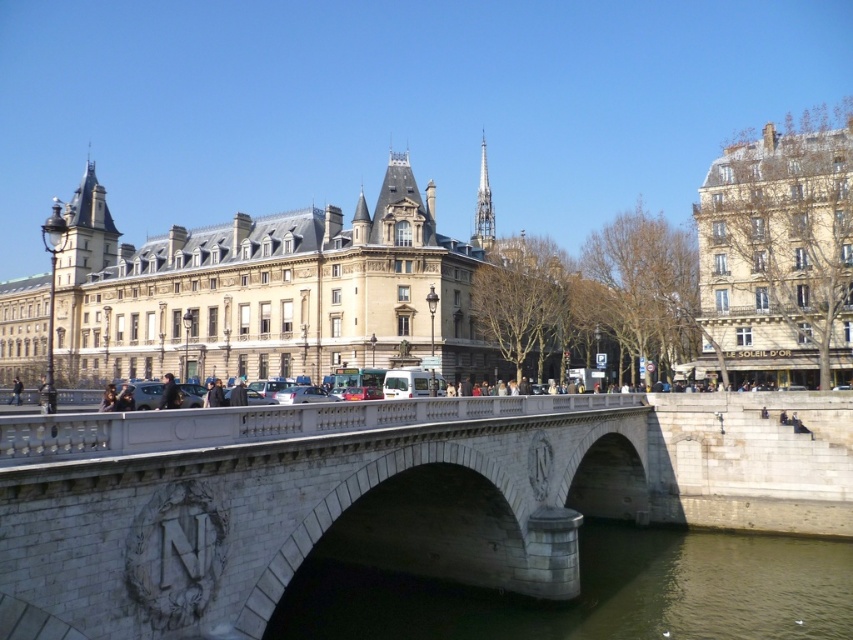
Is white stone bridge at center taller than beige stone building at center?

Incorrect, white stone bridge at center's height is not larger of beige stone building at center's.

Who is lower down, white stone bridge at center or beige stone building at center?

Positioned lower is white stone bridge at center.

Does point (93, 634) come in front of point (115, 371)?

Yes, it is in front of point (115, 371).

Where is `white stone bridge at center`? This screenshot has width=853, height=640. white stone bridge at center is located at coordinates (300, 504).

Locate an element on the screen. beige stone building at right is located at coordinates (776, 259).

Is beige stone building at right to the right of dark gray stone person at center from the viewer's perspective?

Yes, beige stone building at right is to the right of dark gray stone person at center.

This screenshot has height=640, width=853. Identify the location of beige stone building at right. (776, 259).

I want to click on beige stone building at right, so click(776, 259).

Can you confirm if matte black car at center is positioned to the right of dark gray jacket at center?

No, matte black car at center is not to the right of dark gray jacket at center.

Between matte black car at center and dark gray jacket at center, which one is positioned higher?

dark gray jacket at center

Locate an element on the screen. matte black car at center is located at coordinates (148, 394).

This screenshot has width=853, height=640. Identify the location of matte black car at center. (148, 394).